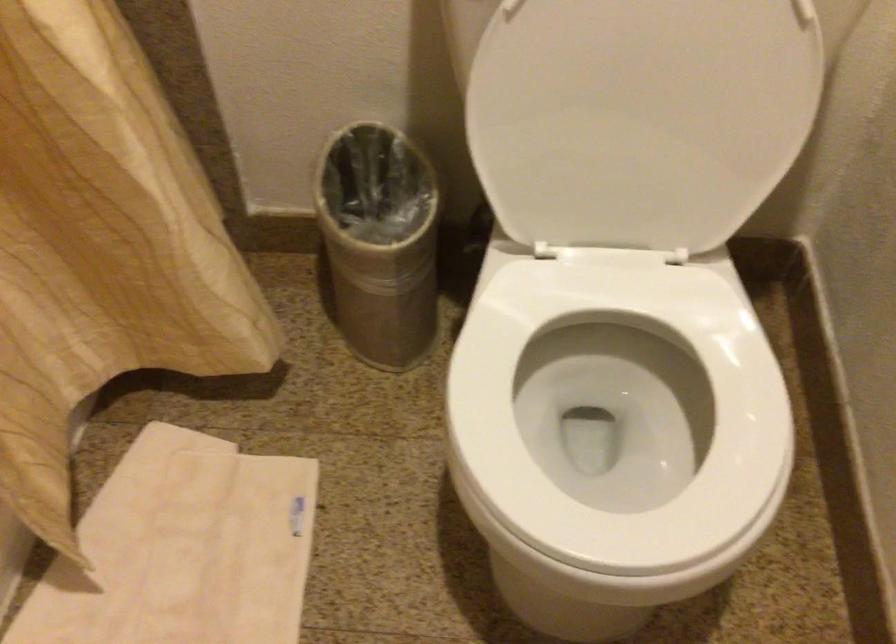
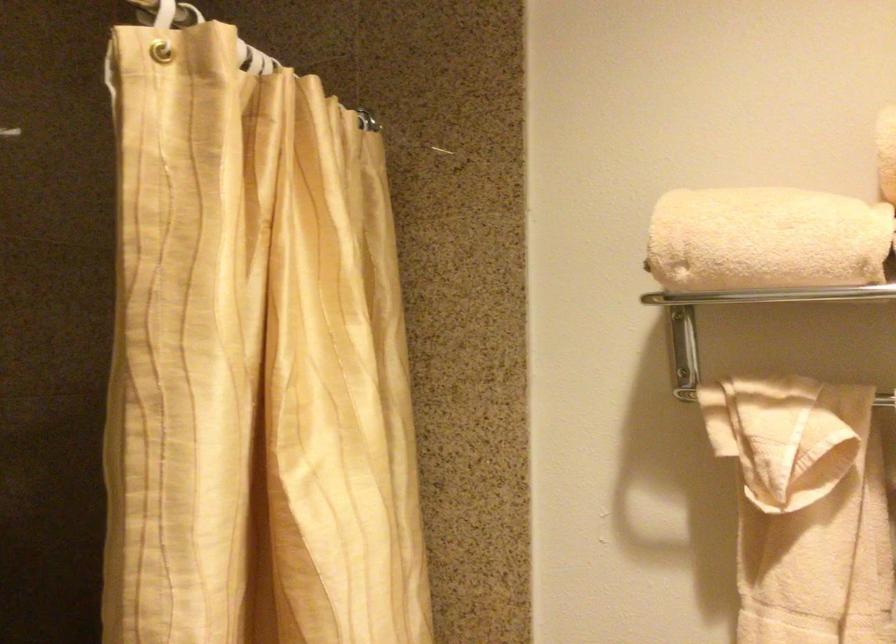
First-person continuous shooting, in which direction is the camera rotating?

The rotation direction of the camera is left-up.